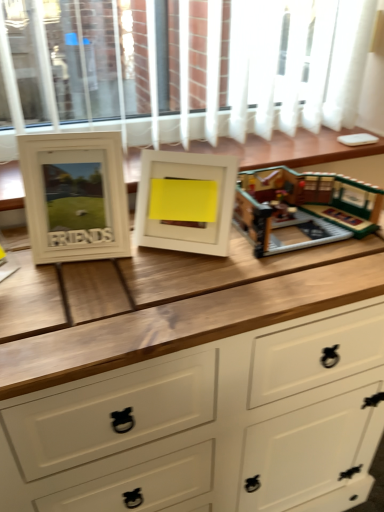
Find the location of a particular element. This screenshot has height=512, width=384. vacant area that is in front of brick-like lego set at center is located at coordinates (291, 272).